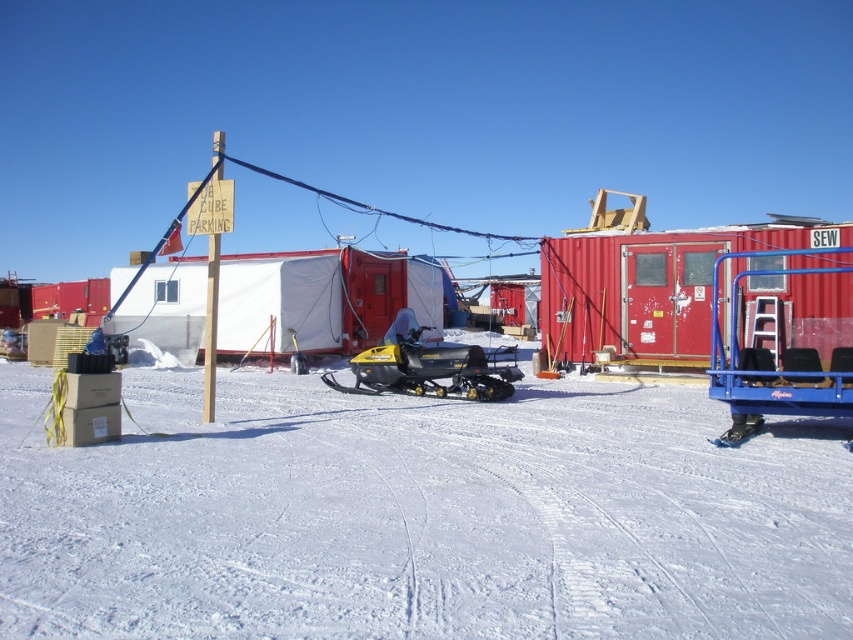
Question: Can you confirm if white powdery snow at center is positioned below yellow matte snowmobile at center?

Choices:
 (A) no
 (B) yes

Answer: (B)

Question: Can you confirm if white powdery snow at center is smaller than yellow matte snowmobile at center?

Choices:
 (A) yes
 (B) no

Answer: (B)

Question: Which point is farther to the camera?

Choices:
 (A) yellow matte snowmobile at center
 (B) white powdery snow at center

Answer: (A)

Question: Is white powdery snow at center above yellow matte snowmobile at center?

Choices:
 (A) yes
 (B) no

Answer: (B)

Question: Among these points, which one is farthest from the camera?

Choices:
 (A) (328, 435)
 (B) (474, 353)

Answer: (B)